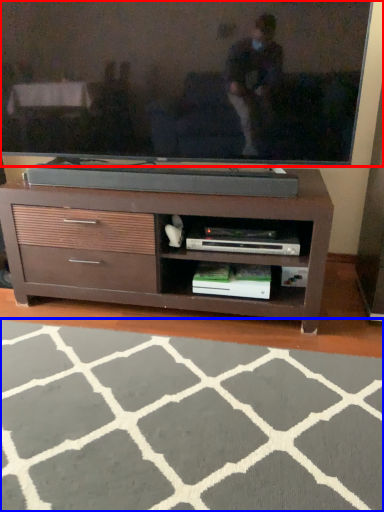
Question: Which of the following is the closest to the observer, television (highlighted by a red box) or plain (highlighted by a blue box)?

Choices:
 (A) television
 (B) plain

Answer: (B)